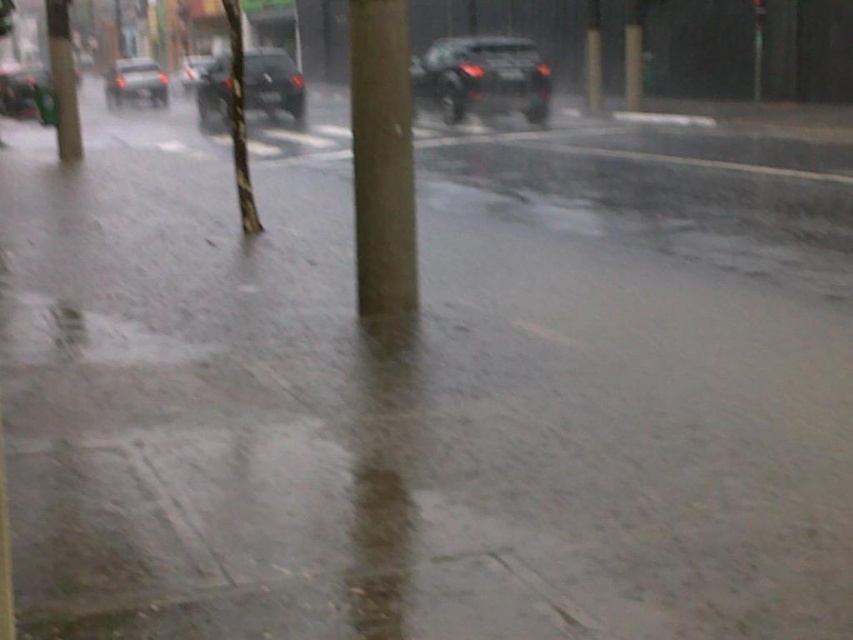
You are standing on the sidewalk in the rainy street scene. You notice two points marked on the ground ahead of you. The first point is at coordinates point (492, 64), and the second is at point (288, 68). Which point is closer to you?

Point (492, 64) is closer to the viewer than point (288, 68).

You are standing at point (x=236, y=115) and want to walk to point (x=387, y=4). Given the flooded sidewalk, which direction should you move to reach your destination?

You should move forward because point (x=387, y=4) is in front of point (x=236, y=115), so walking in that direction will lead you to your destination.

You are a pedestrian trying to cross the street. You see a satin black car at center and a shiny black car at center. Which car is nearer to you?

The satin black car at center is closer to the viewer than the shiny black car at center.